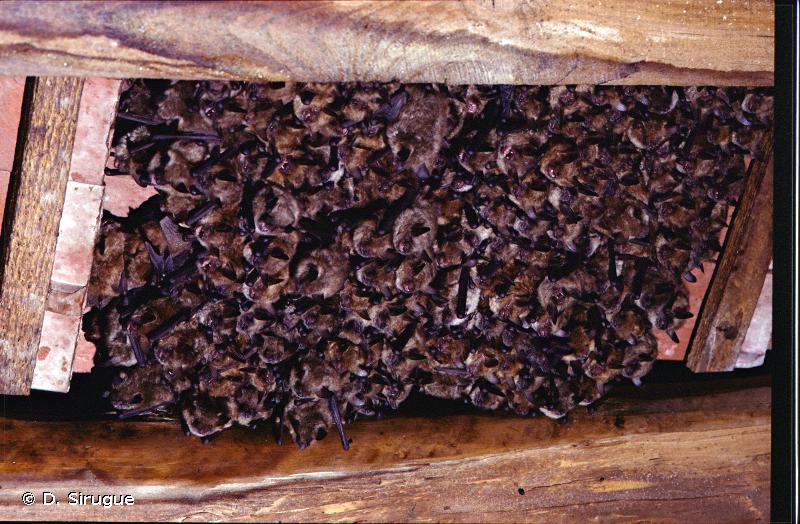
Find the location of `wood beam`. wood beam is located at coordinates (414, 468), (20, 212), (328, 64), (736, 299).